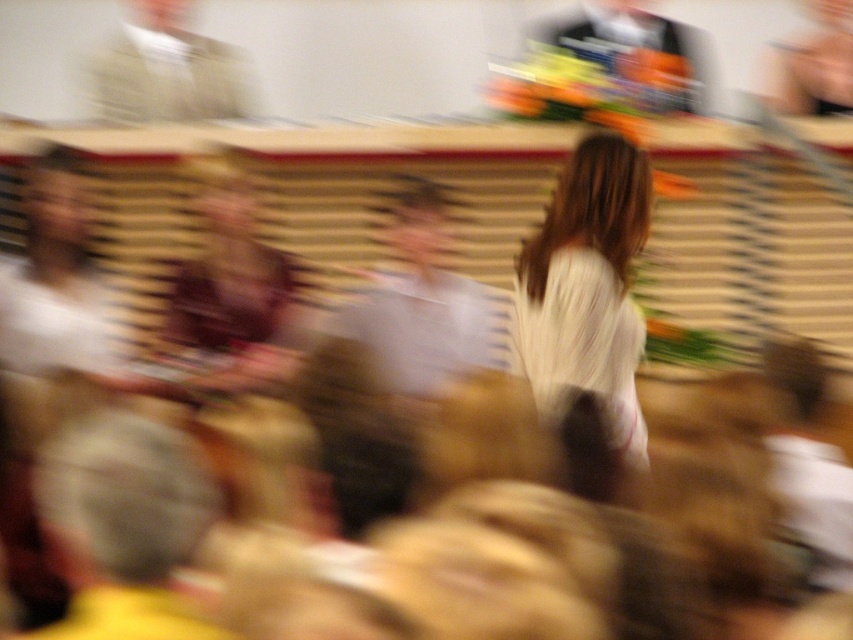
Which is behind, point (631, 429) or point (578, 44)?

The point (578, 44) is behind.

Where is `white silky dress at center`? The width and height of the screenshot is (853, 640). white silky dress at center is located at coordinates (587, 289).

Who is more distant from viewer, (602, 250) or (682, 88)?

Point (682, 88)

The width and height of the screenshot is (853, 640). Identify the location of white silky dress at center. (587, 289).

Who is taller, smooth beige shirt at upper left or shiny metallic vase at upper right?

With more height is shiny metallic vase at upper right.

Can you confirm if smooth beige shirt at upper left is positioned to the right of shiny metallic vase at upper right?

No, smooth beige shirt at upper left is not to the right of shiny metallic vase at upper right.

Consider the image. Who is more forward, (137, 81) or (602, 3)?

Point (137, 81) is more forward.

I want to click on smooth beige shirt at upper left, so click(x=167, y=70).

Consider the image. Does white silky dress at center have a larger size compared to smooth beige shirt at upper left?

No.

Does point (578, 355) lie in front of point (218, 113)?

Yes, it is in front of point (218, 113).

Find the location of a particular element. The image size is (853, 640). white silky dress at center is located at coordinates (587, 289).